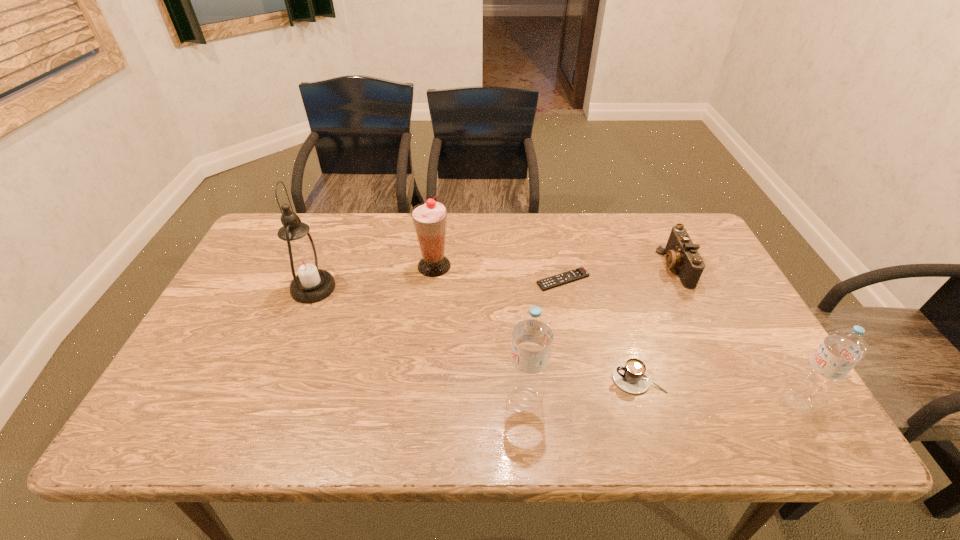
Locate an element on the screen. free point between the shorter water bottle and the cappuccino is located at coordinates (717, 390).

Locate an element on the screen. The image size is (960, 540). free space between the rightmost object and the smoothie is located at coordinates (615, 334).

What are the coordinates of `the fifth closest object to the oil lamp` in the screenshot? It's located at (682, 254).

You are a GUI agent. You are given a task and a screenshot of the screen. Output one action in this format:
    pyautogui.click(x=<x>, y=<y>)
    Task: Click on the third closest object to the shortest object
    
    Given the screenshot: What is the action you would take?
    pyautogui.click(x=429, y=218)

Locate an element on the screen. The image size is (960, 540). free location that satisfies the following two spatial constraints: 1. on the back side of the oil lamp; 2. on the right side of the remote control is located at coordinates (317, 280).

I want to click on free spot that satisfies the following two spatial constraints: 1. on the front side of the oil lamp; 2. on the right side of the left water bottle, so click(269, 401).